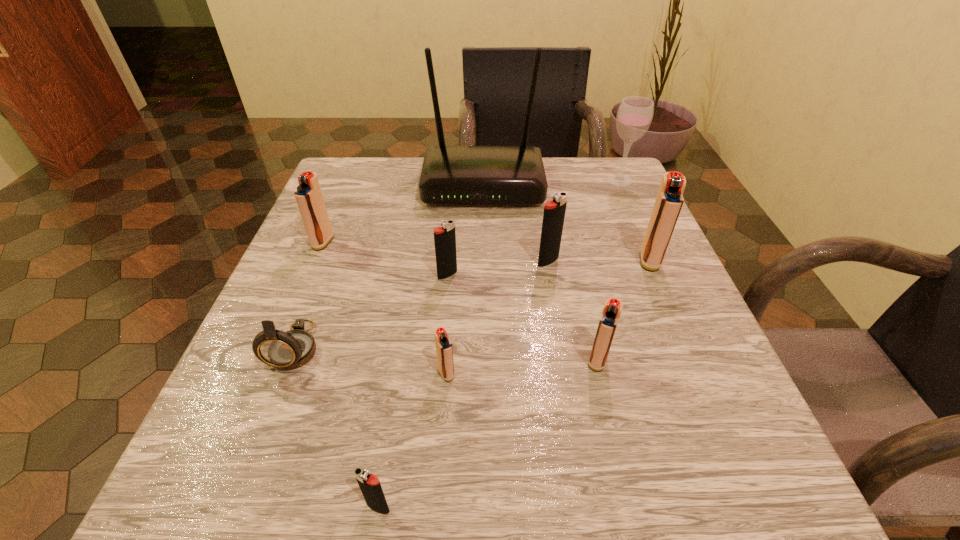
The height and width of the screenshot is (540, 960). Find the location of `object that is the ninth closest to the second red igniter from right to left`. object that is the ninth closest to the second red igniter from right to left is located at coordinates (308, 195).

Select which object appears as the seventh closest to the third smallest red igniter. Please provide its 2D coordinates. Your answer should be formatted as a tuple, i.e. [(x, y)], where the tuple contains the x and y coordinates of a point satisfying the conditions above.

[(612, 309)]

This screenshot has height=540, width=960. I want to click on igniter that can be found as the second closest to the wineglass, so click(x=554, y=211).

Select which igniter appears as the closest to the third red igniter from right to left. Please provide its 2D coordinates. Your answer should be formatted as a tuple, i.e. [(x, y)], where the tuple contains the x and y coordinates of a point satisfying the conditions above.

[(370, 486)]

Point out which red igniter is positioned as the nearest to the router. Please provide its 2D coordinates. Your answer should be formatted as a tuple, i.e. [(x, y)], where the tuple contains the x and y coordinates of a point satisfying the conditions above.

[(308, 195)]

The height and width of the screenshot is (540, 960). Identify the location of red igniter that is the closest to the compass. (308, 195).

Identify which black igniter is located as the second nearest to the leftmost igniter. Please provide its 2D coordinates. Your answer should be formatted as a tuple, i.e. [(x, y)], where the tuple contains the x and y coordinates of a point satisfying the conditions above.

[(554, 211)]

Choose which black igniter is the third nearest neighbor to the leftmost red igniter. Please provide its 2D coordinates. Your answer should be formatted as a tuple, i.e. [(x, y)], where the tuple contains the x and y coordinates of a point satisfying the conditions above.

[(370, 486)]

You are a GUI agent. You are given a task and a screenshot of the screen. Output one action in this format:
    pyautogui.click(x=<x>, y=<y>)
    Task: Click on the vacant space that satisfies the following two spatial constraints: 1. on the back side of the sixth igniter from right to left; 2. on the right side of the wineglass
    Image resolution: width=960 pixels, height=540 pixels.
    Given the screenshot: What is the action you would take?
    pyautogui.click(x=430, y=180)